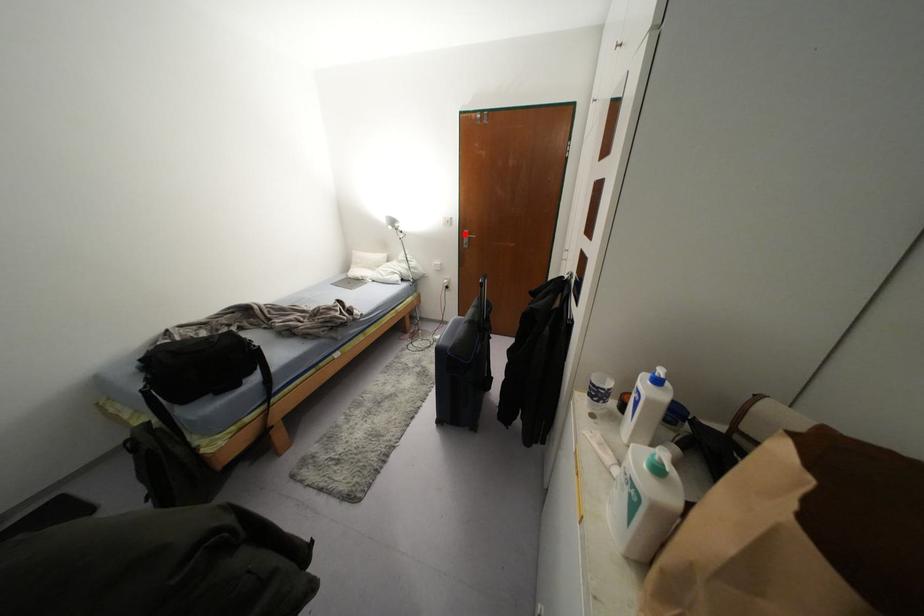
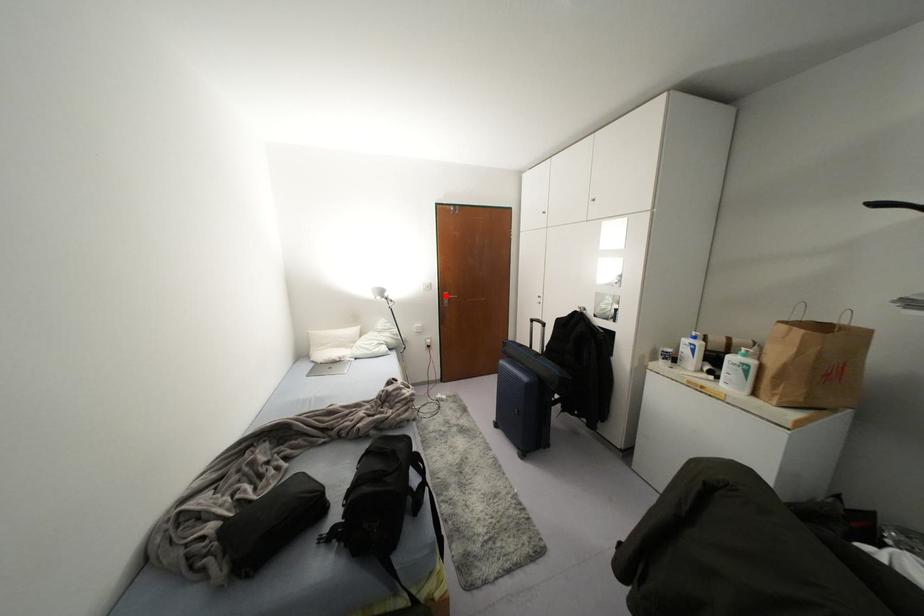
I am providing you with two images of the same scene from different viewpoints. A red point is marked on the first image and another point is marked on the second image. Is the marked point in image1 the same physical position as the marked point in image2?

Yes